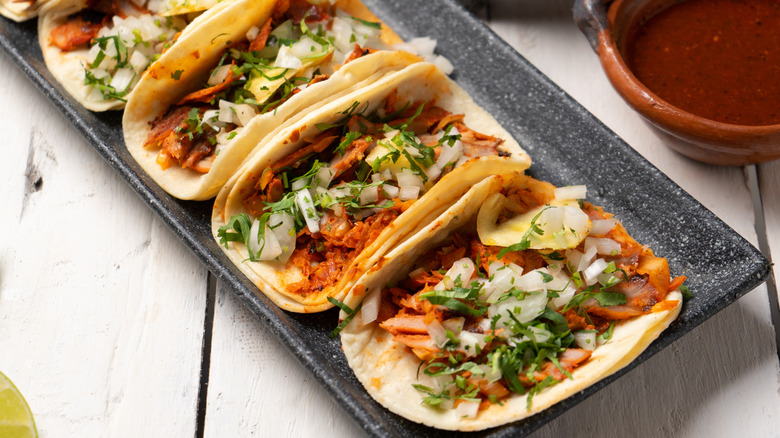
This screenshot has height=438, width=780. Identify the location of grey and white serving tray edges. (647, 204), (505, 69), (320, 347), (104, 125).